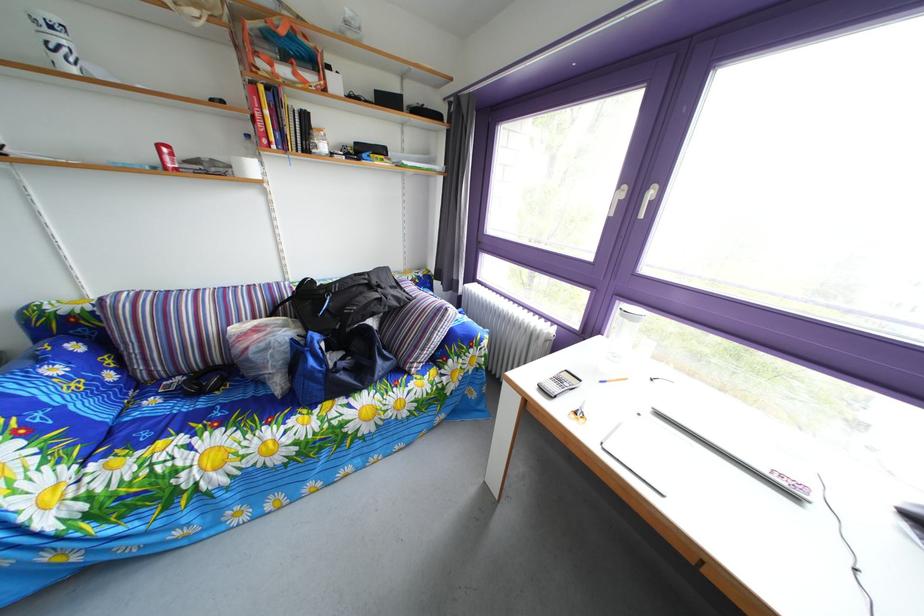
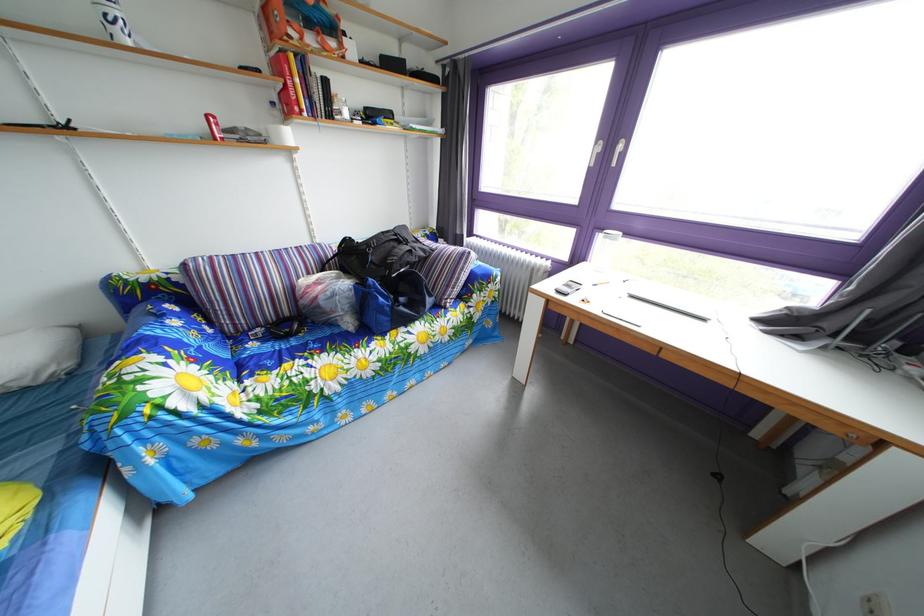
Locate, in the second image, the point that corresponds to (x=164, y=410) in the first image.

(262, 353)